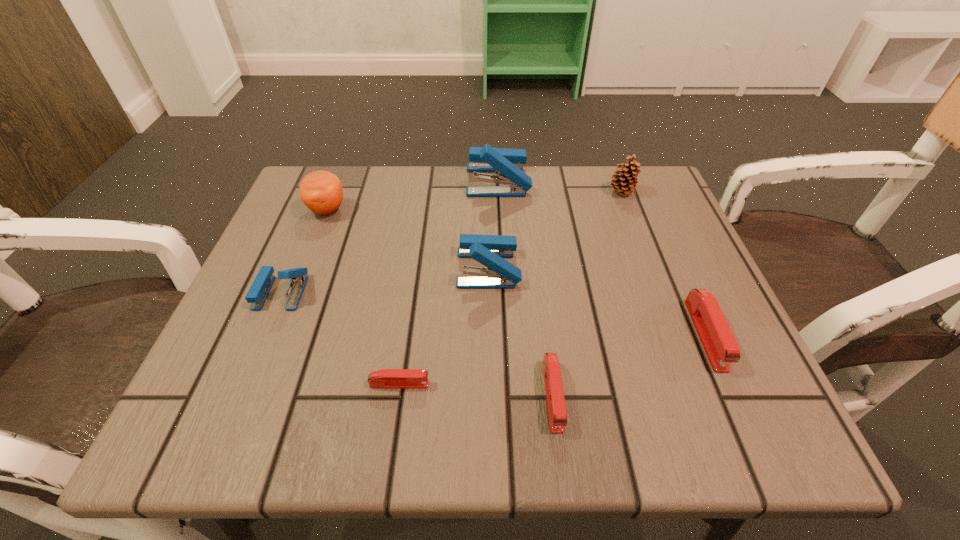
The width and height of the screenshot is (960, 540). Find the location of `the fifth tallest stapler`. the fifth tallest stapler is located at coordinates (557, 415).

You are a GUI agent. You are given a task and a screenshot of the screen. Output one action in this format:
    pyautogui.click(x=<x>, y=<y>)
    Task: Click on the leftmost red stapler
    This screenshot has height=540, width=960.
    Given the screenshot: What is the action you would take?
    pyautogui.click(x=385, y=378)

Where is `the shortest stapler`? The height and width of the screenshot is (540, 960). the shortest stapler is located at coordinates (385, 378).

The width and height of the screenshot is (960, 540). What are the coordinates of `free space located 0.330m on the left of the tallest stapler` in the screenshot? It's located at (329, 181).

Where is `vacant space located on the front of the orange`? The height and width of the screenshot is (540, 960). vacant space located on the front of the orange is located at coordinates click(281, 327).

At what (x,y) coordinates should I click in order to perform the action: click on vacant space located 0.380m on the front of the second object from right to left. Please return your answer as a coordinate pair (x, y). Image resolution: width=960 pixels, height=540 pixels. Looking at the image, I should click on (676, 336).

Image resolution: width=960 pixels, height=540 pixels. Find the location of `free point located on the back of the second tallest stapler`. free point located on the back of the second tallest stapler is located at coordinates (487, 212).

Locate an element on the screen. This screenshot has height=540, width=960. vacant region located 0.100m on the front of the smallest blue stapler is located at coordinates (252, 359).

Where is `free location located 0.110m on the front-facing side of the rightmost object`? The height and width of the screenshot is (540, 960). free location located 0.110m on the front-facing side of the rightmost object is located at coordinates 753,442.

The width and height of the screenshot is (960, 540). Identify the location of vacant space situated 0.050m on the front-facing side of the shortest stapler. (462, 384).